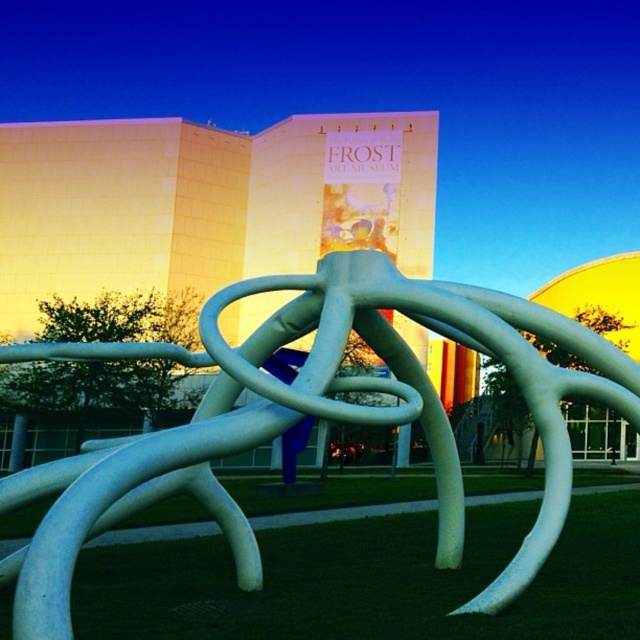
You are standing at the entrance of the Frost Art Museum and want to take a photo of the white glossy sculpture at center. According to the scene description, where should you position yourself to ensure the sculpture is in the frame?

The white glossy sculpture at center is located at point [310,413], so positioning yourself at the entrance facing towards the center of the scene would place the sculpture within the frame.

You are a maintenance worker needing to water the green grass at lower center. You have a hose that can reach 2 meters. The white glossy sculpture at center is in the way. Can you water the grass without moving the sculpture?

The white glossy sculpture at center and green grass at lower center are 2.23 meters apart. Since the hose can only reach 2 meters, you cannot water the grass without moving the sculpture.